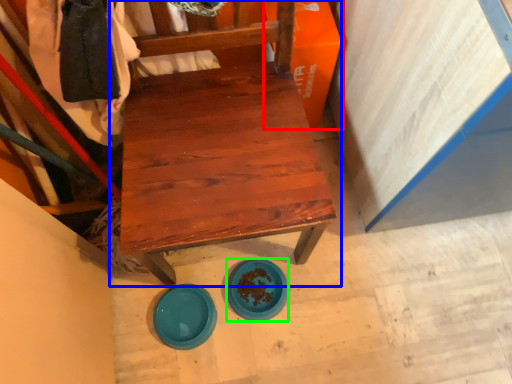
Question: Which object is positioned closest to cardboard box (highlighted by a red box)? Select from chair (highlighted by a blue box) and plate (highlighted by a green box).

Choices:
 (A) chair
 (B) plate

Answer: (A)